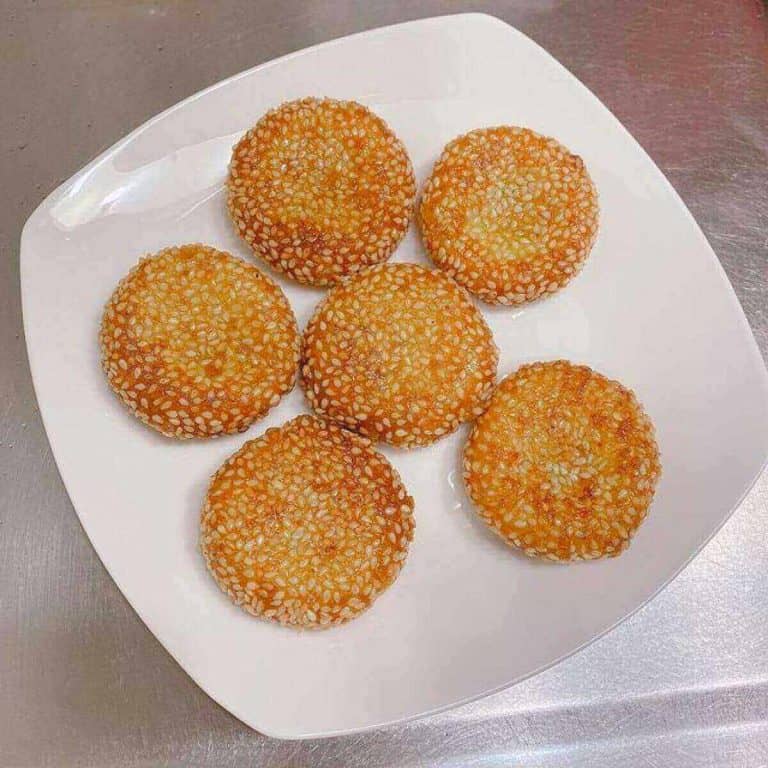
Identify the location of edge of dish. (482, 18), (104, 151), (101, 571), (709, 242), (576, 650).